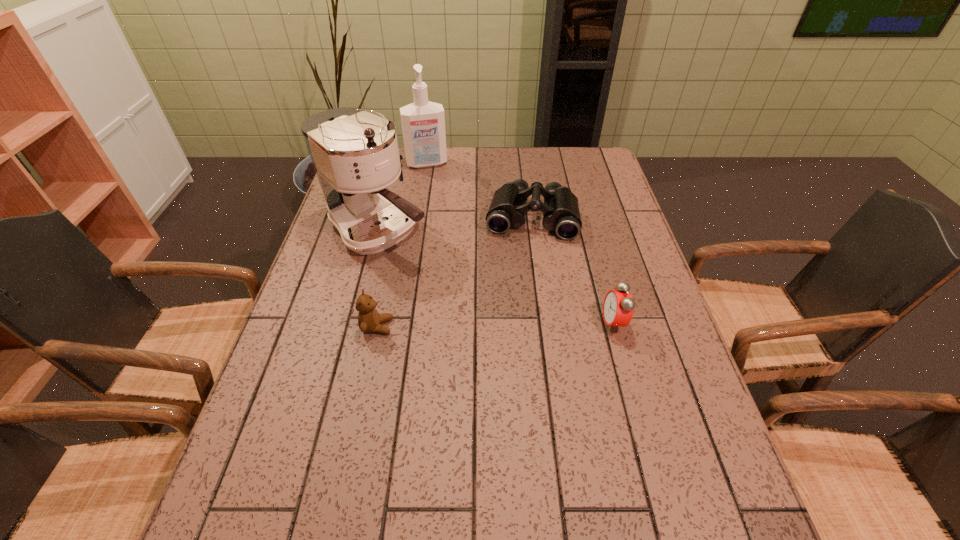
The width and height of the screenshot is (960, 540). I want to click on free space located on the front label of the farthest object, so click(435, 187).

Identify the location of vacant space located on the front label of the farthest object. The image size is (960, 540). (442, 212).

The width and height of the screenshot is (960, 540). Find the location of `vacant area situated 0.380m on the front-facing side of the coffee maker`. vacant area situated 0.380m on the front-facing side of the coffee maker is located at coordinates (518, 329).

Find the location of a particular element. vacant region located on the front-facing side of the coffee maker is located at coordinates (442, 275).

What are the coordinates of `vacant space located on the front-facing side of the coffee maker` in the screenshot? It's located at (x=436, y=271).

Locate an element on the screen. This screenshot has height=540, width=960. free spot located on the front-facing side of the binoculars is located at coordinates (521, 300).

The height and width of the screenshot is (540, 960). I want to click on vacant area located on the front-facing side of the binoculars, so click(x=526, y=255).

At what (x,y) coordinates should I click in order to perform the action: click on vacant region located on the front-facing side of the binoculars. Please return your answer as a coordinate pair (x, y). The width and height of the screenshot is (960, 540). Looking at the image, I should click on (526, 258).

Find the location of `object present at the far edge`. object present at the far edge is located at coordinates (423, 122).

Identify the location of object at the left edge. (355, 154).